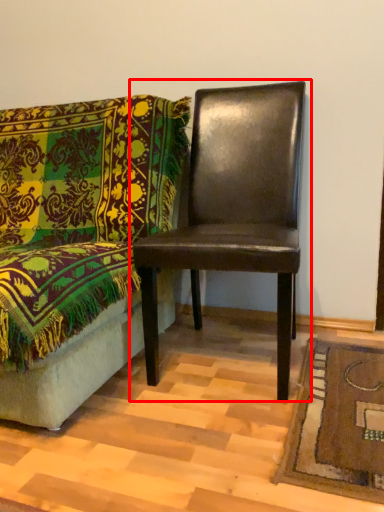
Question: From the image's perspective, what is the correct spatial positioning of chair (annotated by the red box) in reference to chair?

Choices:
 (A) below
 (B) above

Answer: (B)